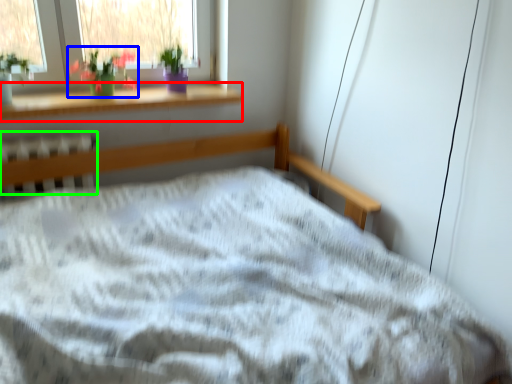
Question: Which is farther away from window sill (highlighted by a red box)? floral arrangement (highlighted by a blue box) or radiator (highlighted by a green box)?

Choices:
 (A) floral arrangement
 (B) radiator

Answer: (B)